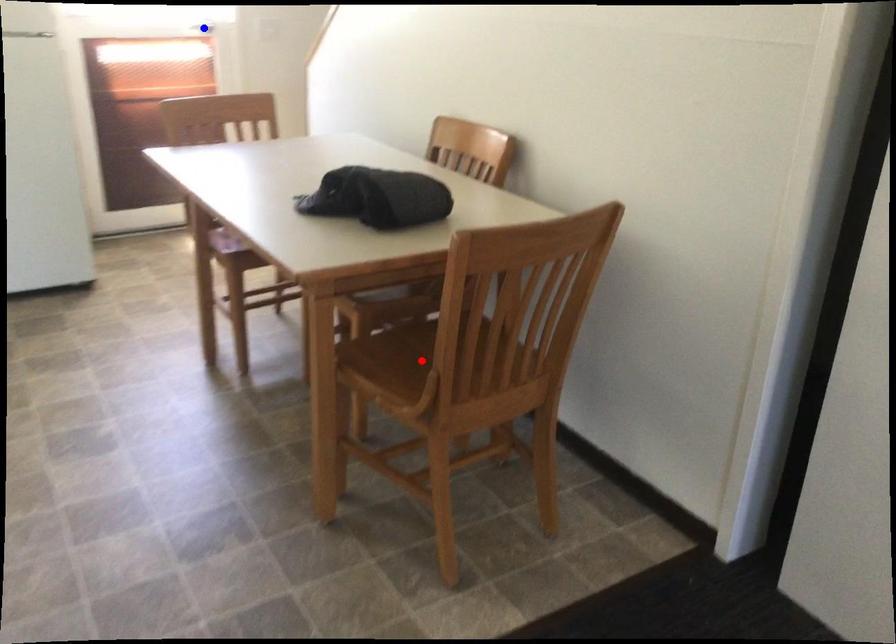
Question: Two points are marked on the image. Which point is closer to the camera?

Choices:
 (A) Blue point is closer.
 (B) Red point is closer.

Answer: (B)